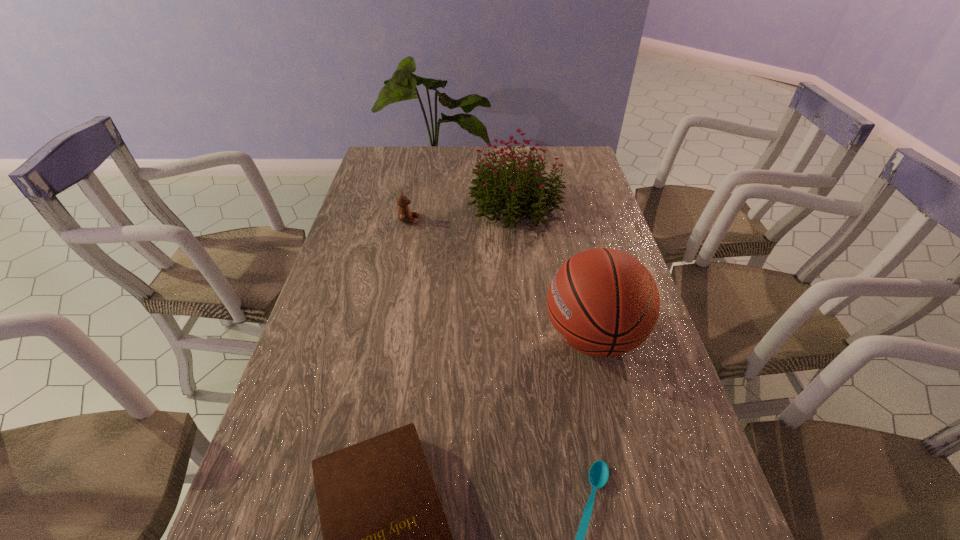
At what (x,y) coordinates should I click in order to perform the action: click on bouquet. Please return your answer as a coordinate pair (x, y). The width and height of the screenshot is (960, 540). Looking at the image, I should click on tap(491, 181).

At what (x,y) coordinates should I click in order to perform the action: click on the third nearest object. Please return your answer as a coordinate pair (x, y). Image resolution: width=960 pixels, height=540 pixels. Looking at the image, I should click on (603, 302).

Where is `the third shortest object`? Image resolution: width=960 pixels, height=540 pixels. the third shortest object is located at coordinates (404, 213).

The width and height of the screenshot is (960, 540). What are the coordinates of `free space located 0.250m on the left of the bouquet` in the screenshot? It's located at (396, 204).

In order to click on vacant space situated on the logo side of the third farthest object in this screenshot , I will do `click(395, 337)`.

Identify the location of free location located 0.260m on the logo side of the third farthest object. The height and width of the screenshot is (540, 960). (439, 337).

This screenshot has height=540, width=960. What are the coordinates of `free region located on the logo side of the third farthest object` in the screenshot? It's located at (423, 337).

Locate an element on the screen. free location located 0.360m on the front-facing side of the teddy bear is located at coordinates (527, 220).

The image size is (960, 540). What are the coordinates of `bouquet located at the right edge` in the screenshot? It's located at (491, 181).

Where is `basketball situated at the right edge`? The width and height of the screenshot is (960, 540). basketball situated at the right edge is located at coordinates (603, 302).